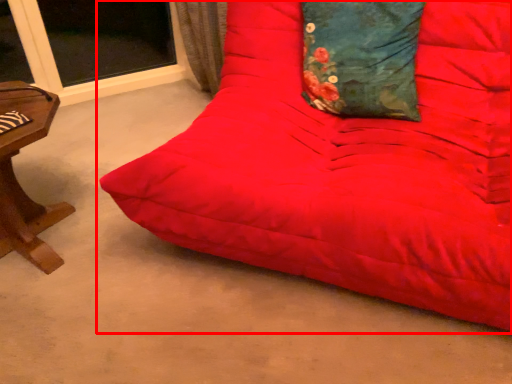
Question: From the image's perspective, considering the relative positions of studio couch (annotated by the red box) and pillow in the image provided, where is studio couch (annotated by the red box) located with respect to the staircase?

Choices:
 (A) below
 (B) above

Answer: (A)